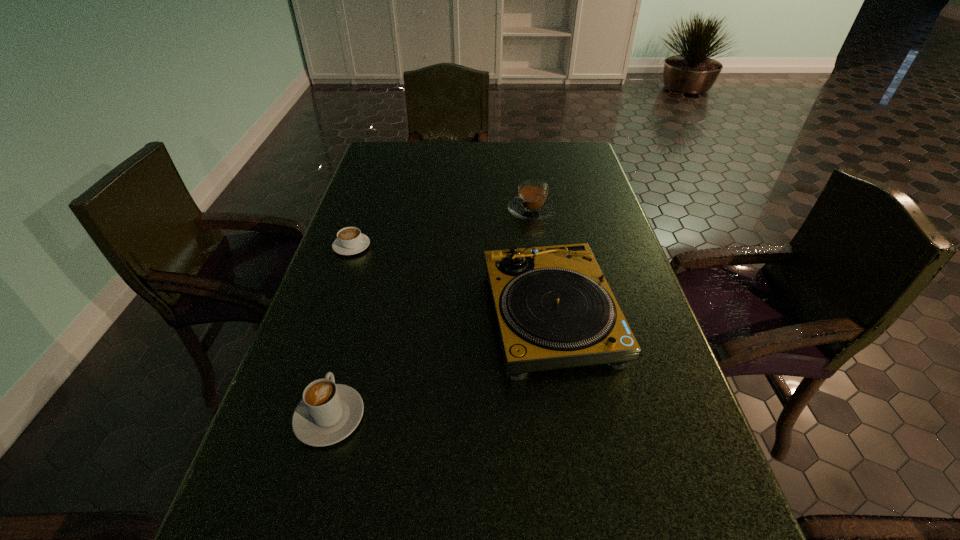
The height and width of the screenshot is (540, 960). I want to click on free space located to the right of the nearest object, so click(x=345, y=362).

Find the location of a particular element. Image resolution: width=960 pixels, height=540 pixels. blank space located 0.060m to the right of the nearest object is located at coordinates (345, 362).

Image resolution: width=960 pixels, height=540 pixels. Identify the location of vacant region located 0.150m on the side of the shortest object with the handle. (426, 246).

Image resolution: width=960 pixels, height=540 pixels. What are the coordinates of `record player positioned at the right edge` in the screenshot? It's located at (554, 308).

This screenshot has width=960, height=540. I want to click on cappuccino located at the right edge, so click(532, 204).

In the image, there is a desktop. Where is `vacant area at the far edge`? The image size is (960, 540). vacant area at the far edge is located at coordinates (487, 167).

Find the location of a particular element. The width and height of the screenshot is (960, 540). vacant region at the left edge of the desktop is located at coordinates (387, 256).

Locate an element on the screen. free location at the right edge is located at coordinates (586, 202).

Identify the location of vacant area at the far left corner of the desktop. The image size is (960, 540). (367, 163).

You are a GUI agent. You are given a task and a screenshot of the screen. Output one action in this format:
    pyautogui.click(x=<x>, y=<y>)
    Task: Click on the free space at the far right corner of the desktop
    This screenshot has height=540, width=960.
    Given the screenshot: What is the action you would take?
    pyautogui.click(x=570, y=170)